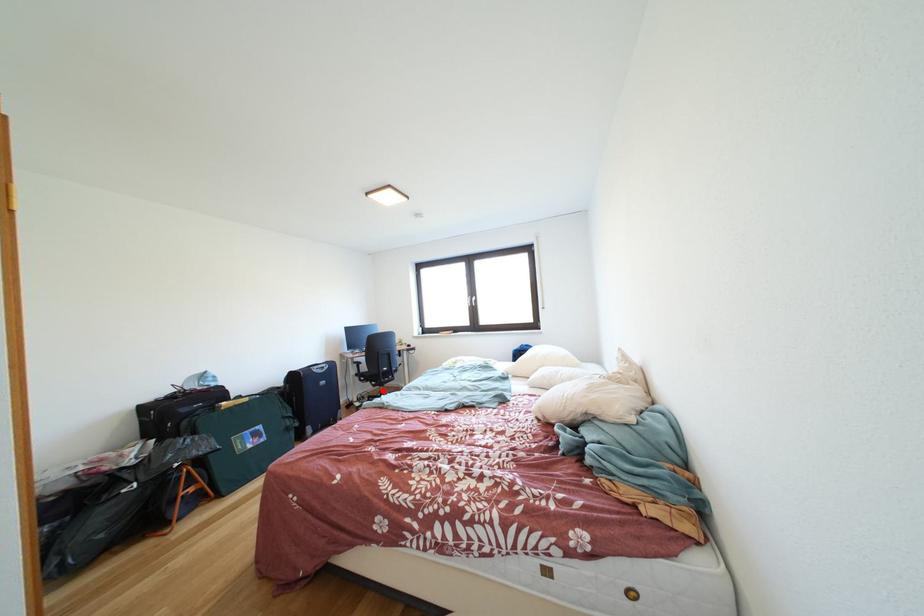
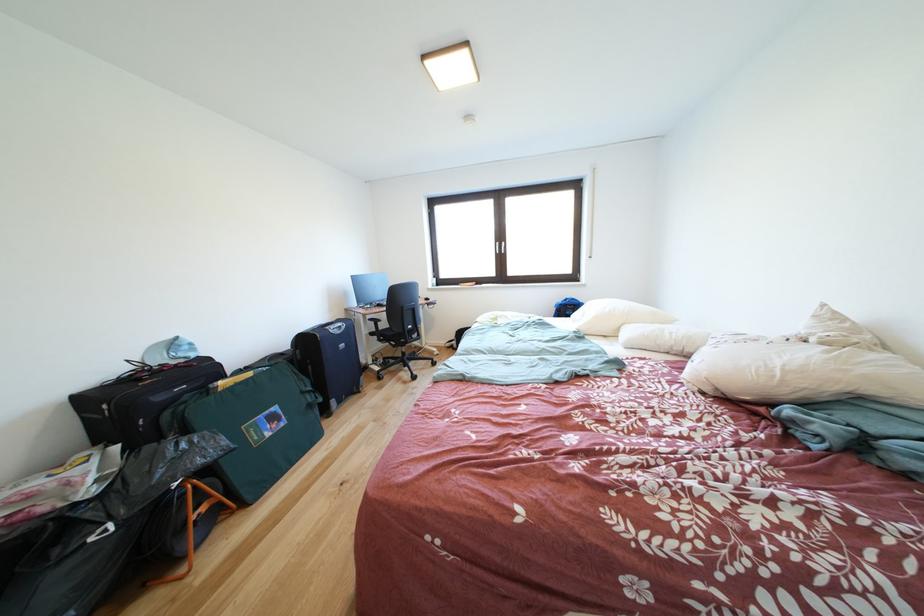
Question: I am providing you with two images of the same scene from different viewpoints. Given a red point in image1, look at the same physical point in image2. Is it:

Choices:
 (A) Closer to the viewpoint
 (B) Farther from the viewpoint

Answer: (A)